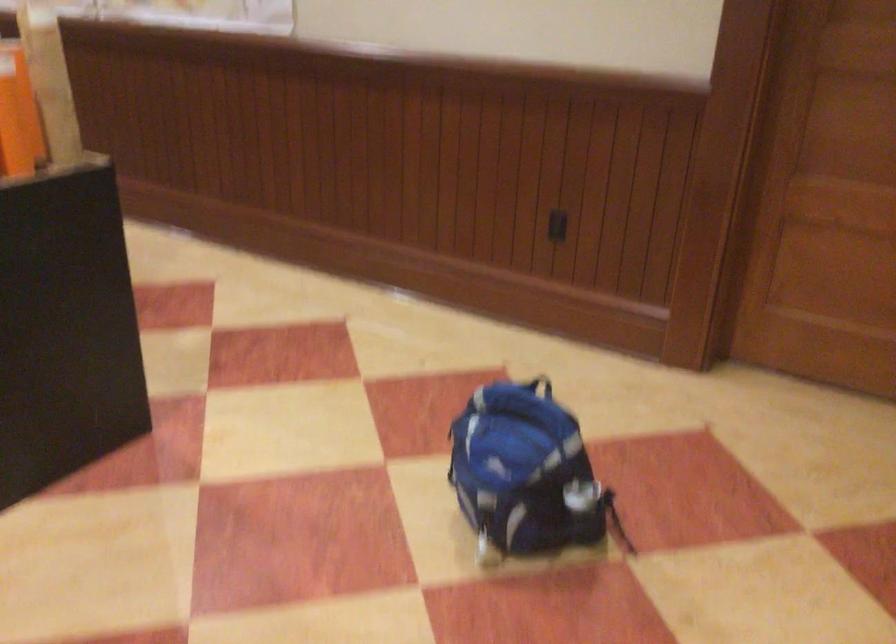
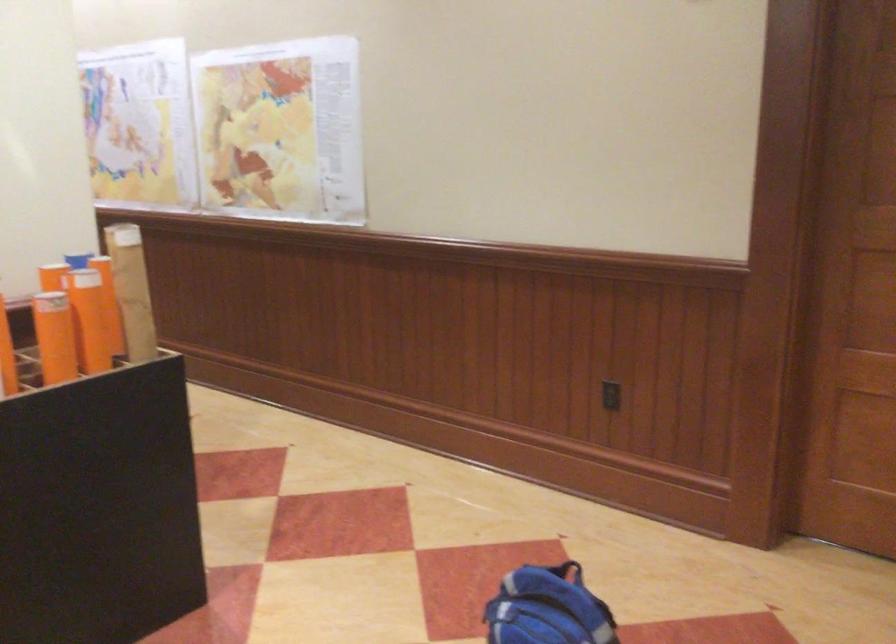
The point at [557,225] is marked in the first image. Where is the corresponding point in the second image?

(609, 395)